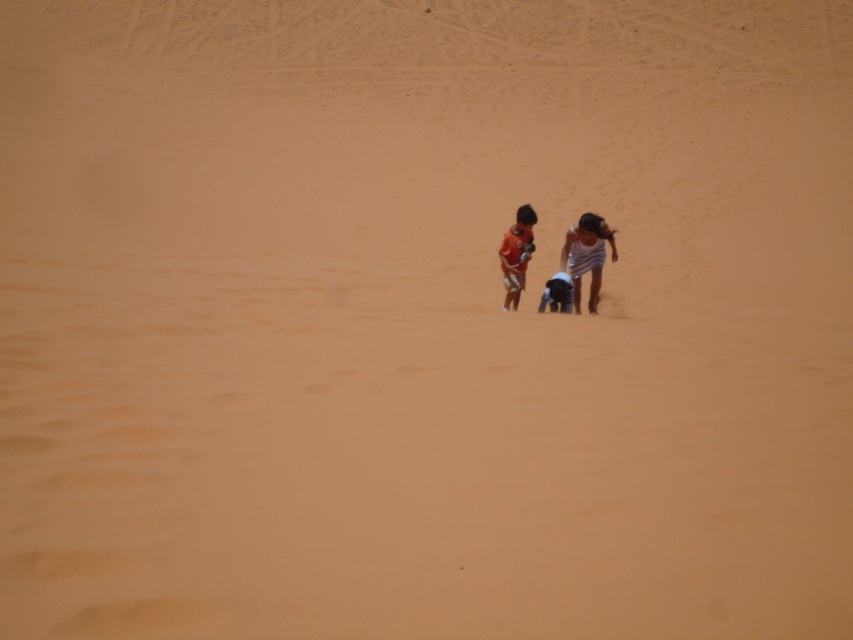
Question: Estimate the real-world distances between objects in this image. Which object is farther from the matte black shorts at center?

Choices:
 (A) white striped dress at center
 (B) orange matte shirt at center

Answer: (B)

Question: Among these objects, which one is farthest from the camera?

Choices:
 (A) white striped dress at center
 (B) matte black shorts at center
 (C) orange matte shirt at center

Answer: (B)

Question: Is white striped dress at center bigger than orange matte shirt at center?

Choices:
 (A) yes
 (B) no

Answer: (A)

Question: Is white striped dress at center positioned at the back of matte black shorts at center?

Choices:
 (A) no
 (B) yes

Answer: (A)

Question: Is white striped dress at center further to the viewer compared to matte black shorts at center?

Choices:
 (A) no
 (B) yes

Answer: (A)

Question: Estimate the real-world distances between objects in this image. Which object is farther from the orange matte shirt at center?

Choices:
 (A) white striped dress at center
 (B) matte black shorts at center

Answer: (A)